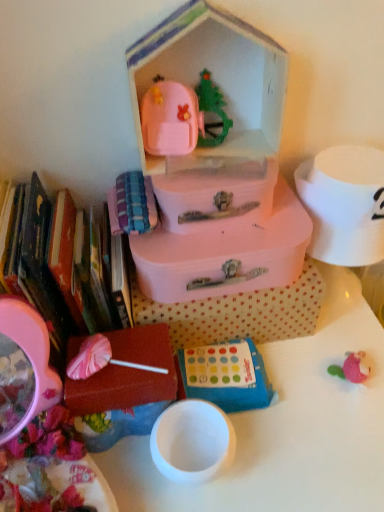
Question: Looking at their shapes, would you say blue fabric game at center is wider or thinner than matte pink suitcase at center, which is the 4th storage box from bottom to top?

Choices:
 (A) wide
 (B) thin

Answer: (B)

Question: Visually, is blue fabric game at center positioned to the left or to the right of matte pink suitcase at center, which is the 4th storage box from bottom to top?

Choices:
 (A) left
 (B) right

Answer: (B)

Question: Considering the real-world distances, which object is closest to the white glossy table at center?

Choices:
 (A) pink plastic suitcase at upper center
 (B) pink matte lollipop at lower left, the 1th storage box ordered from the bottom
 (C) blue fabric game at center
 (D) pink matte suitcase at center, the 2th storage box in the bottom-to-top sequence
 (E) matte pink suitcase at center, arranged as the 3th storage box when ordered from the bottom

Answer: (C)

Question: Considering the real-world distances, which object is farthest from the blue fabric game at center?

Choices:
 (A) pink matte lollipop at lower left, which is counted as the 4th storage box, starting from the top
 (B) matte pink suitcase at center, positioned as the 1th storage box in top-to-bottom order
 (C) pink matte suitcase at center, the third storage box positioned from the top
 (D) matte pink book at left
 (E) pink plastic suitcase at upper center

Answer: (E)